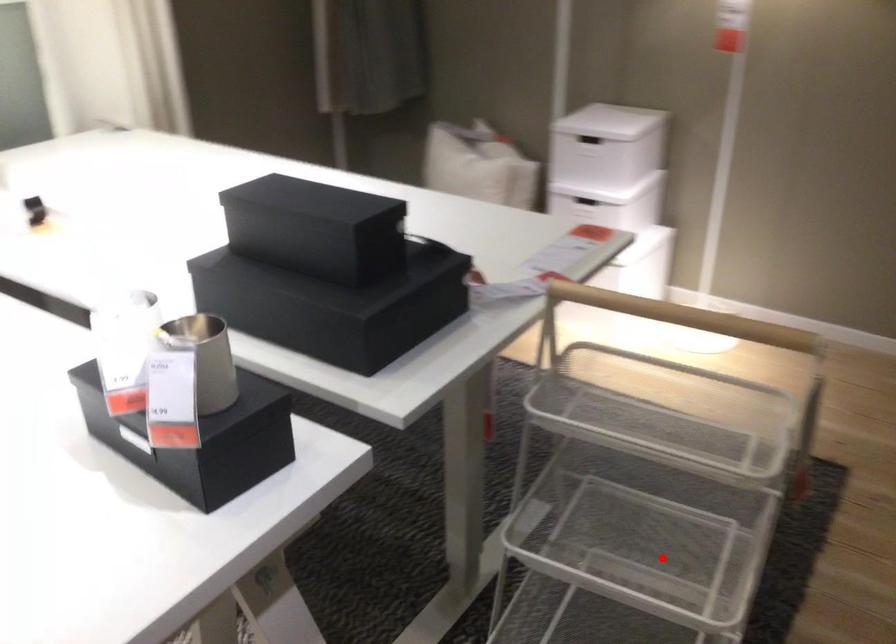
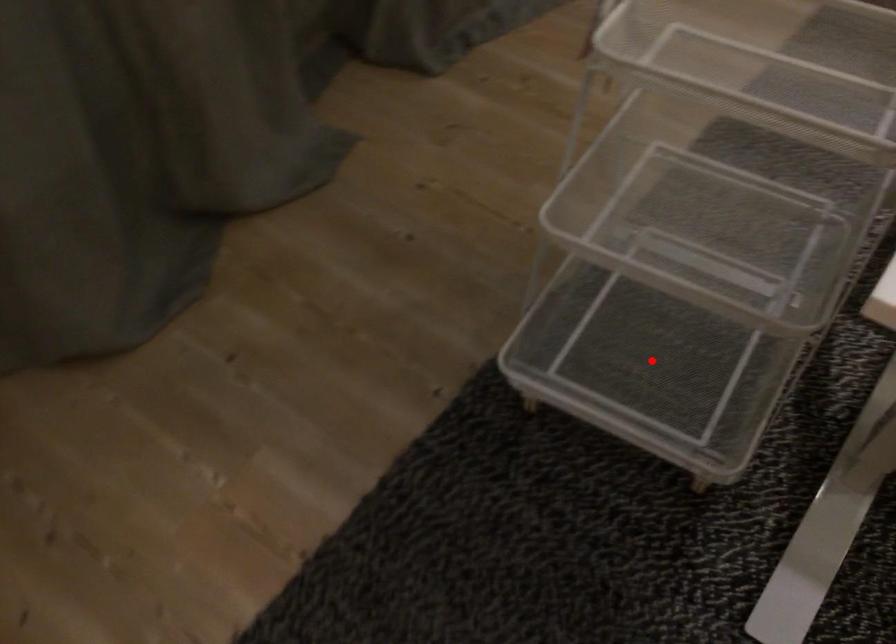
I am providing you with two images of the same scene from different viewpoints. A red point is marked on the first image and another point is marked on the second image. Are the points marked in image1 and image2 representing the same 3D position?

No